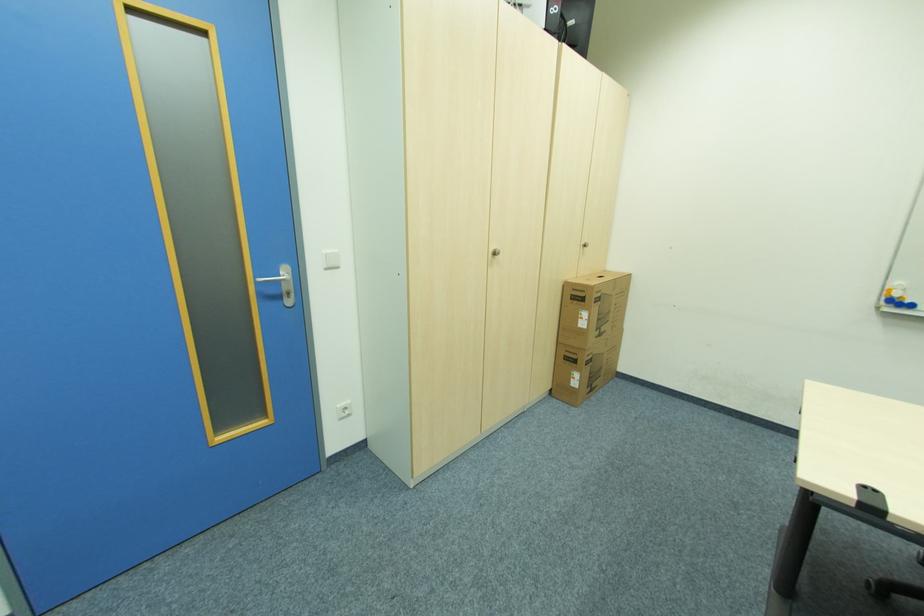
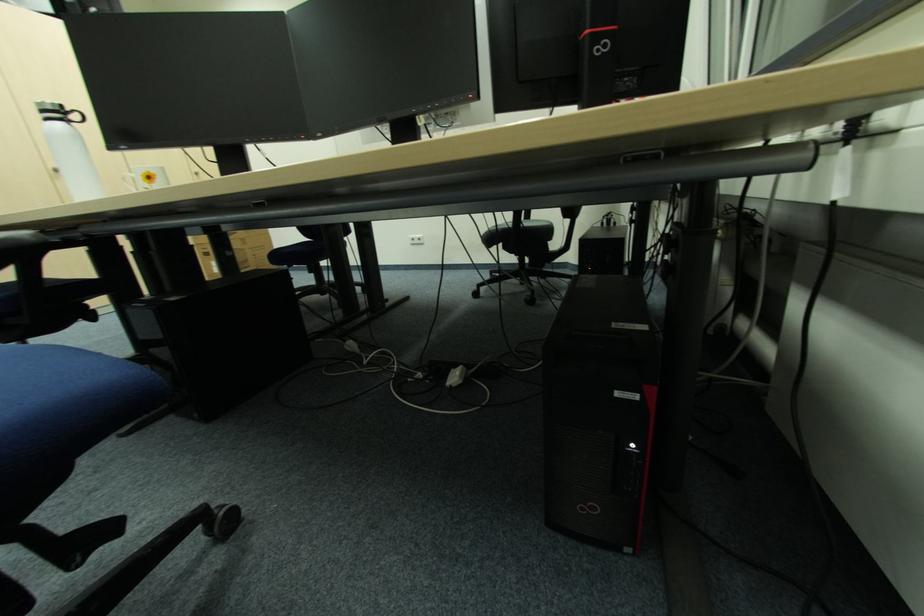
In a continuous first-person perspective shot, in which direction is the camera moving?

The cameraman moved toward right, backward.